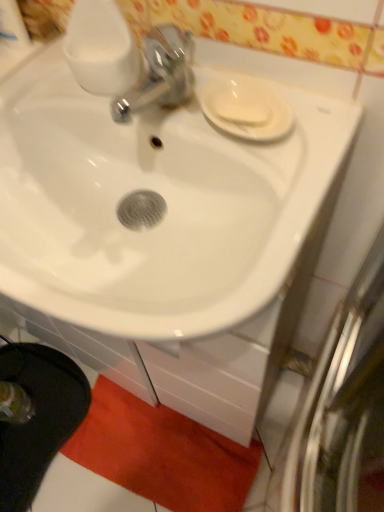
What are the coordinates of `free location to the right of white matte soap at upper right` in the screenshot? It's located at (311, 115).